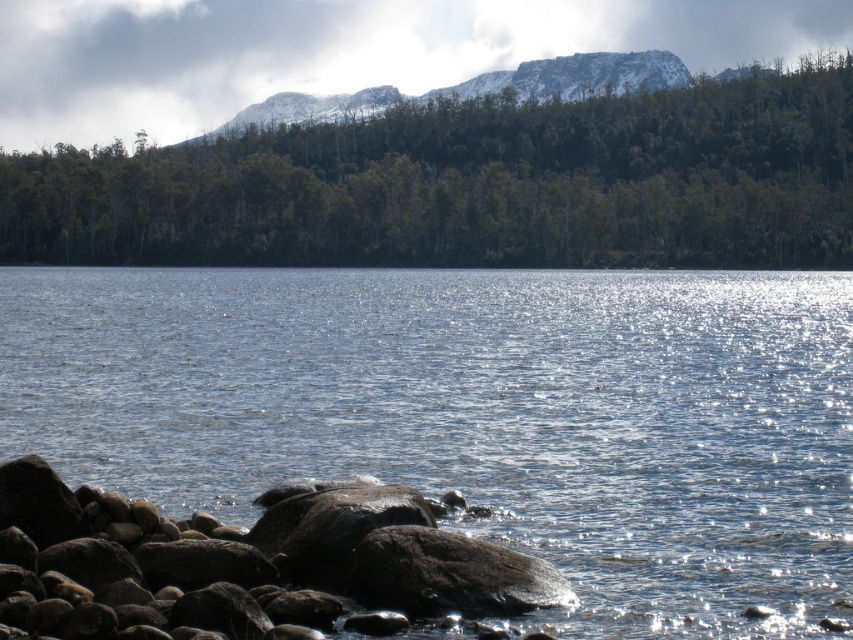
Question: Does glistening blue water at center appear on the left side of green matte tree at upper center?

Choices:
 (A) no
 (B) yes

Answer: (B)

Question: Does glistening blue water at center appear under green matte tree at upper center?

Choices:
 (A) no
 (B) yes

Answer: (B)

Question: Which point is farther from the camera taking this photo?

Choices:
 (A) (473, 342)
 (B) (793, 189)

Answer: (B)

Question: Where is glistening blue water at center located in relation to green matte tree at upper center in the image?

Choices:
 (A) above
 (B) below

Answer: (B)

Question: Which object appears farthest from the camera in this image?

Choices:
 (A) green matte tree at upper center
 (B) glistening blue water at center

Answer: (A)